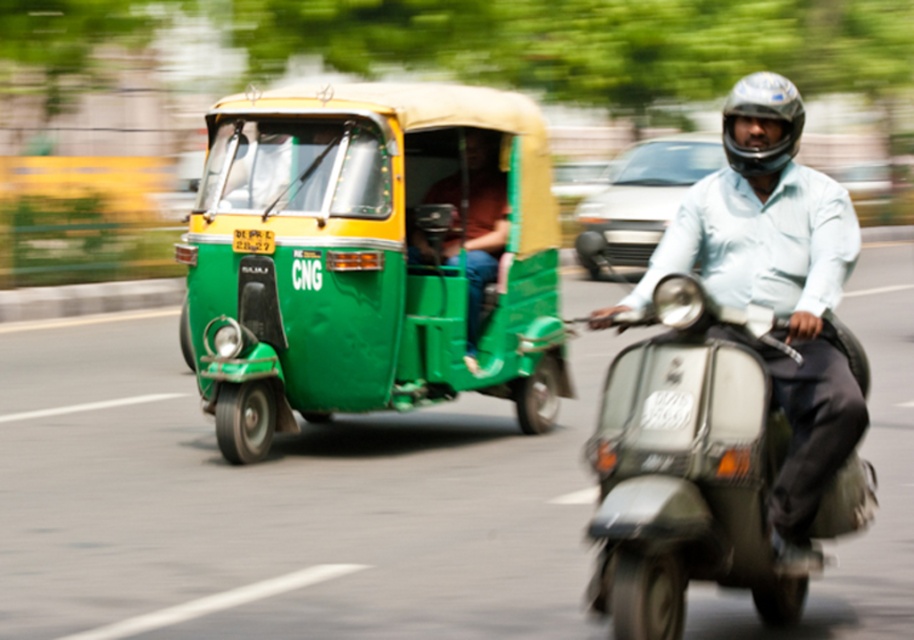
Question: Is metallic silver scooter at center below shiny black helmet at upper right?

Choices:
 (A) no
 (B) yes

Answer: (B)

Question: In this image, where is metallic silver scooter at center located relative to shiny black helmet at upper right?

Choices:
 (A) below
 (B) above

Answer: (A)

Question: Which of the following is the farthest from the observer?

Choices:
 (A) (764, 570)
 (B) (774, 77)

Answer: (B)

Question: Which point appears farthest from the camera in this image?

Choices:
 (A) (736, 108)
 (B) (667, 422)

Answer: (A)

Question: Does metallic silver scooter at center have a smaller size compared to shiny black helmet at upper right?

Choices:
 (A) no
 (B) yes

Answer: (B)